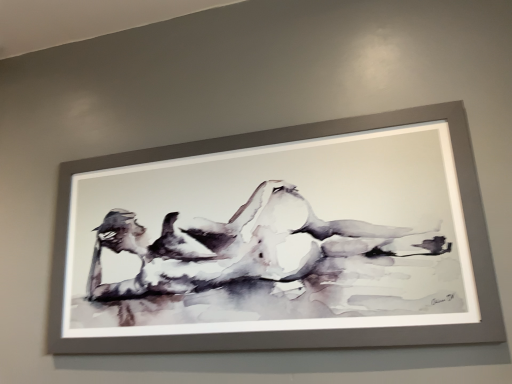
What do you see at coordinates (278, 241) in the screenshot?
I see `matte gray picture frame at center` at bounding box center [278, 241].

At what (x,y) coordinates should I click in order to perform the action: click on matte gray picture frame at center. Please return your answer as a coordinate pair (x, y). This screenshot has height=384, width=512. Looking at the image, I should click on (278, 241).

I want to click on matte gray picture frame at center, so click(278, 241).